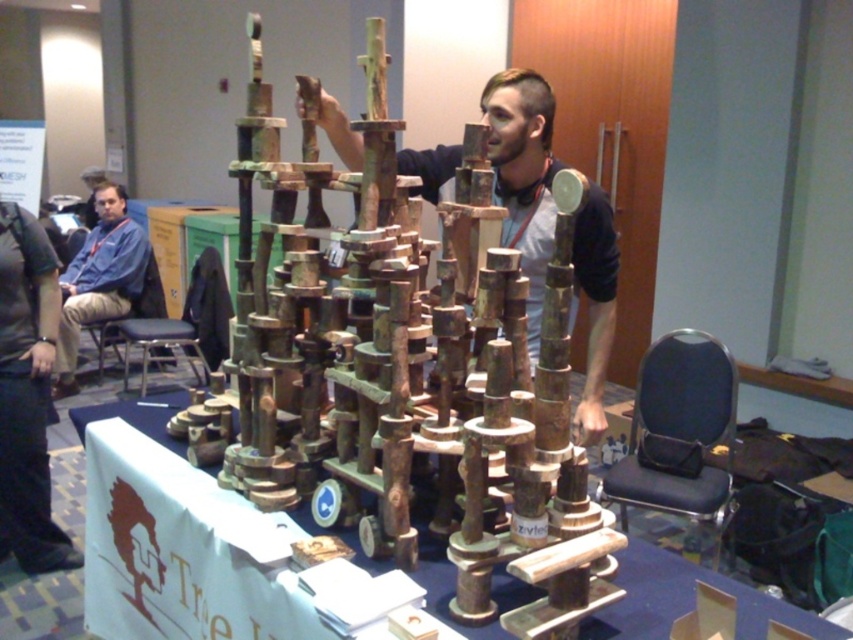
Question: Does wooden sculpture at center lie behind rusty metal structure at center?

Choices:
 (A) no
 (B) yes

Answer: (A)

Question: Which point is closer to the camera?

Choices:
 (A) blue shirt at left
 (B) wooden sculpture at center
 (C) rusty metal structure at center
 (D) blue fabric stool at lower left

Answer: (B)

Question: Which point is closer to the camera taking this photo?

Choices:
 (A) (442, 547)
 (B) (120, 332)
 (C) (322, 435)
 (D) (115, 269)

Answer: (A)

Question: Which point is farther to the camera?

Choices:
 (A) rusty metal structure at center
 (B) blue fabric stool at lower left

Answer: (B)

Question: Can you confirm if rusty wood sculpture at center is bigger than wooden sculpture at center?

Choices:
 (A) no
 (B) yes

Answer: (B)

Question: Can you confirm if rusty wood sculpture at center is wider than blue shirt at left?

Choices:
 (A) yes
 (B) no

Answer: (A)